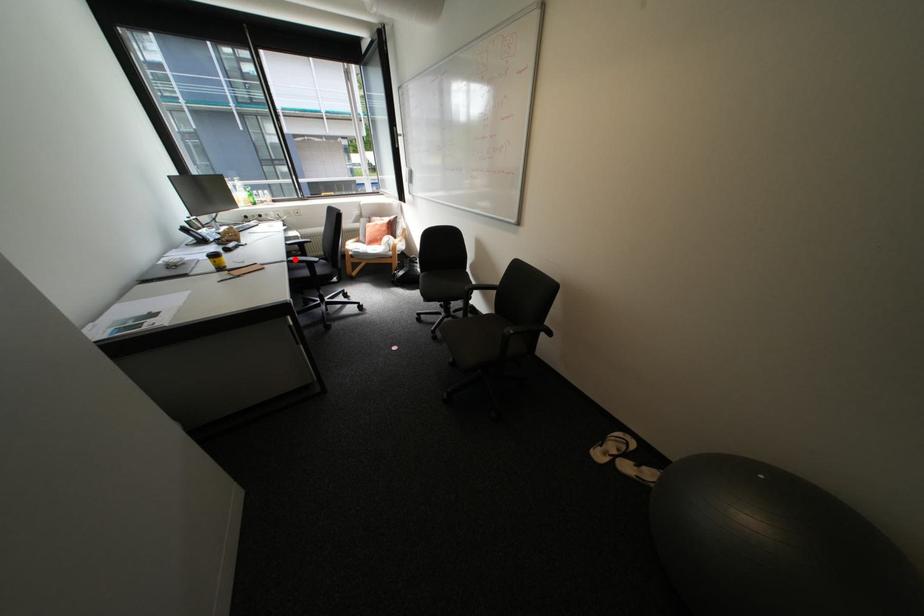
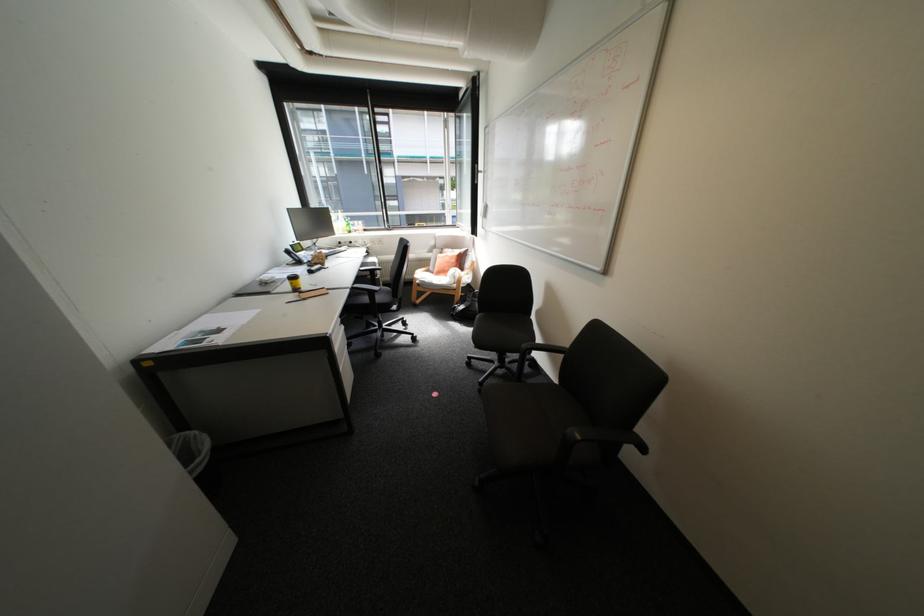
Find the pixel in the second image that matches the highlighted location in the first image.

(359, 286)